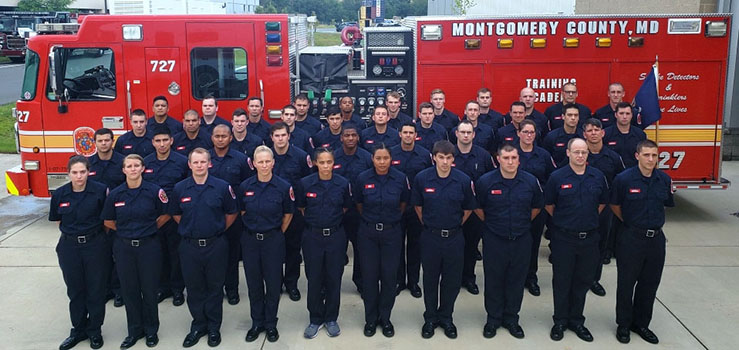
Image resolution: width=739 pixels, height=350 pixels. What are the coordinates of `handles` in the screenshot? It's located at (126, 97), (259, 87).